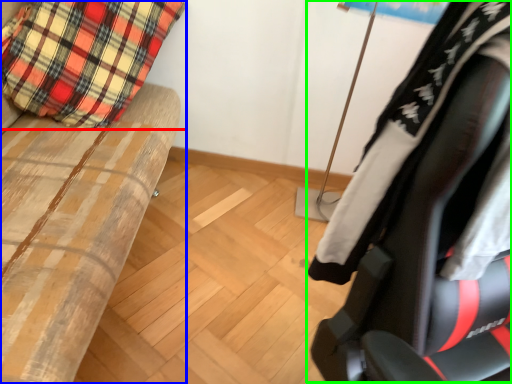
Question: Which is farther away from pillow (highlighted by a red box)? furniture (highlighted by a blue box) or chair (highlighted by a green box)?

Choices:
 (A) furniture
 (B) chair

Answer: (B)